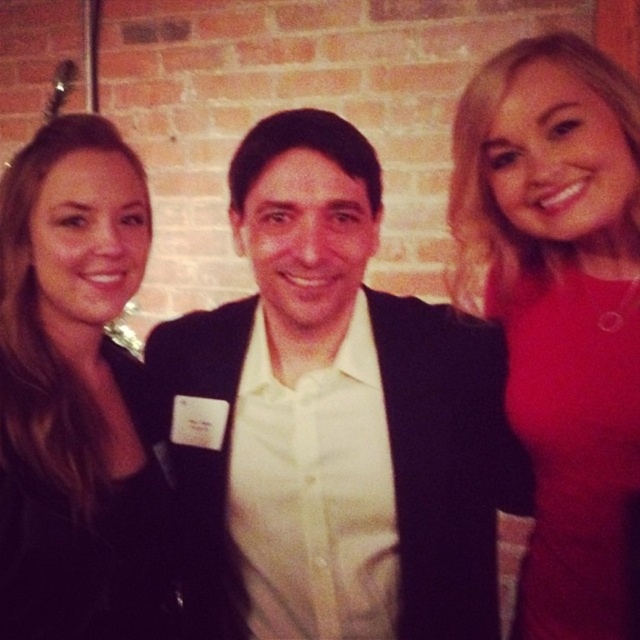
Question: Considering the relative positions of black leather jacket at left and matte red dress at right in the image provided, where is black leather jacket at left located with respect to matte red dress at right?

Choices:
 (A) below
 (B) above

Answer: (B)

Question: Observing the image, what is the correct spatial positioning of black leather jacket at left in reference to matte red dress at right?

Choices:
 (A) above
 (B) below

Answer: (A)

Question: Which of these objects is positioned closest to the black leather jacket at left?

Choices:
 (A) matte red dress at right
 (B) white matte shirt at center

Answer: (B)

Question: Considering the relative positions of black leather jacket at left and matte red dress at right in the image provided, where is black leather jacket at left located with respect to matte red dress at right?

Choices:
 (A) below
 (B) above

Answer: (B)

Question: Which object is farther from the camera taking this photo?

Choices:
 (A) black leather jacket at left
 (B) white matte shirt at center
 (C) matte red dress at right

Answer: (C)

Question: Which object is positioned farthest from the white matte shirt at center?

Choices:
 (A) black leather jacket at left
 (B) matte red dress at right

Answer: (B)